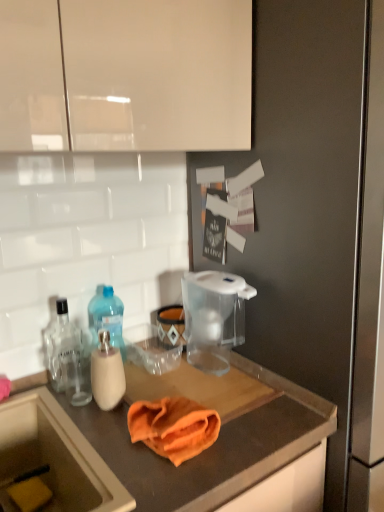
At what (x,y) coordinates should I click in order to perform the action: click on vacant space behind orange microfiber cloth at center. Please return your answer as a coordinate pair (x, y). This screenshot has height=512, width=384. Looking at the image, I should click on (183, 386).